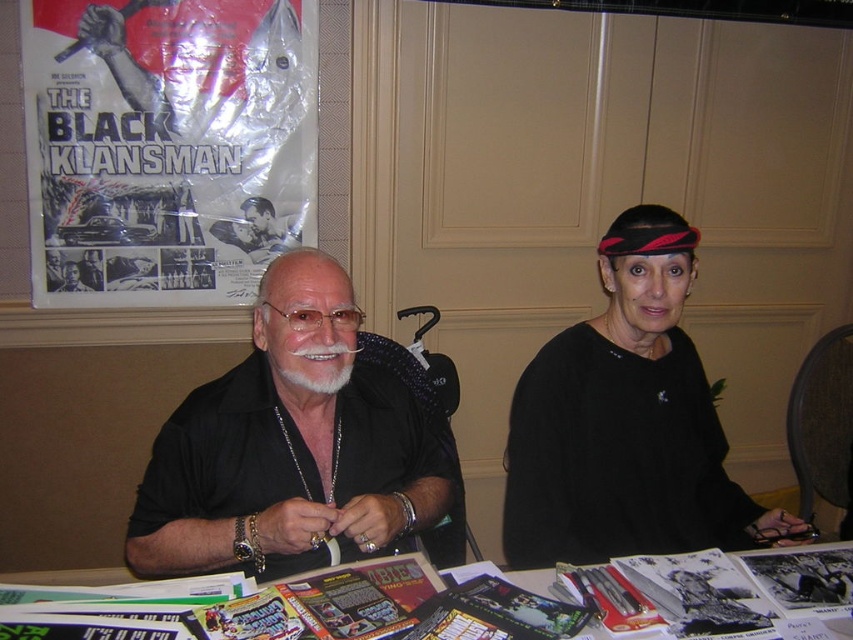
You are a photographer at the signing event and need to adjust the lighting to ensure the black matte headband at upper right is well illuminated. Given its position at point coordinates, how would you position the light source to best highlight it?

To best highlight the black matte headband at upper right, position the light source directly above it at point coordinates to ensure even illumination and reduce shadows.